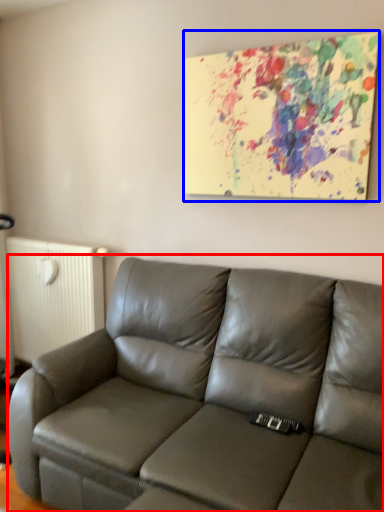
Question: Among these objects, which one is farthest to the camera, studio couch (highlighted by a red box) or picture frame (highlighted by a blue box)?

Choices:
 (A) studio couch
 (B) picture frame

Answer: (B)